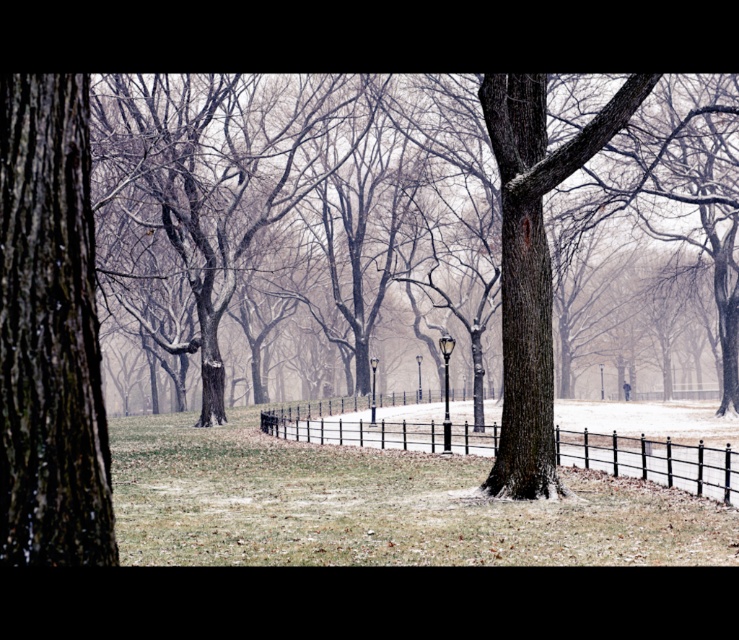
What do you see at coordinates (50, 332) in the screenshot? I see `smooth bark tree at left` at bounding box center [50, 332].

Which is behind, point (18, 250) or point (715, 125)?

Point (715, 125)

Is point (16, 141) less distant than point (582, 128)?

Yes, point (16, 141) is closer to viewer.

Find the location of `smooth bark tree at left`. smooth bark tree at left is located at coordinates (50, 332).

Does smooth bark tree at left have a greater width compared to black metal fence at center?

No.

Looking at this image, can you confirm if smooth bark tree at left is positioned below black metal fence at center?

No.

Which is behind, point (115, 564) or point (466, 451)?

Point (466, 451)

You are a GUI agent. You are given a task and a screenshot of the screen. Output one action in this format:
    pyautogui.click(x=<x>, y=<y>)
    Task: Click on the smooth bark tree at left
    The image size is (739, 640).
    Given the screenshot: What is the action you would take?
    pyautogui.click(x=50, y=332)

Does smooth bark tree at center appear on the right side of black metal fence at center?

Correct, you'll find smooth bark tree at center to the right of black metal fence at center.

Locate an element on the screen. The height and width of the screenshot is (640, 739). smooth bark tree at center is located at coordinates (678, 189).

Is point (704, 195) closer to viewer compared to point (650, 470)?

No.

Where is `smooth bark tree at center`? This screenshot has height=640, width=739. smooth bark tree at center is located at coordinates (678, 189).